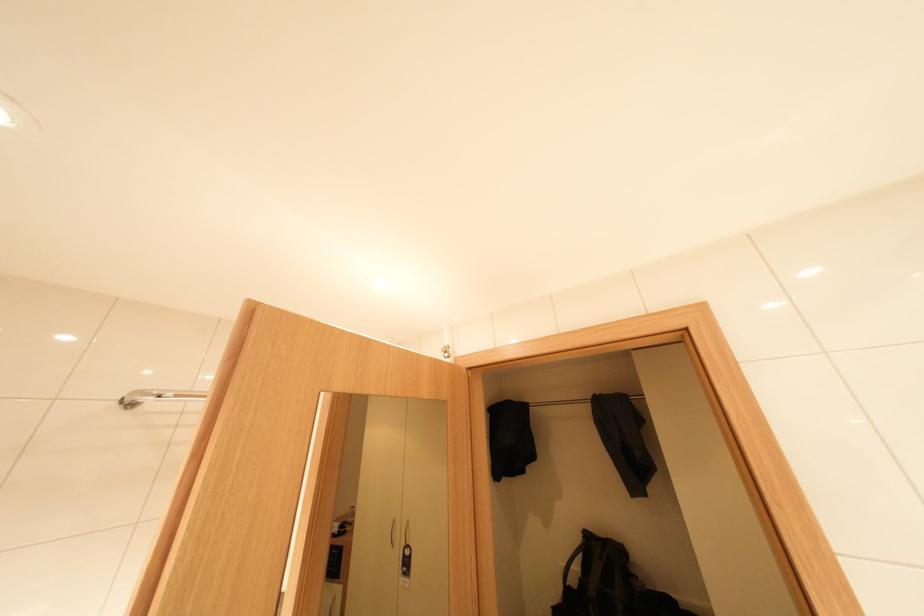
The width and height of the screenshot is (924, 616). Describe the element at coordinates (609, 584) in the screenshot. I see `a black travel bag` at that location.